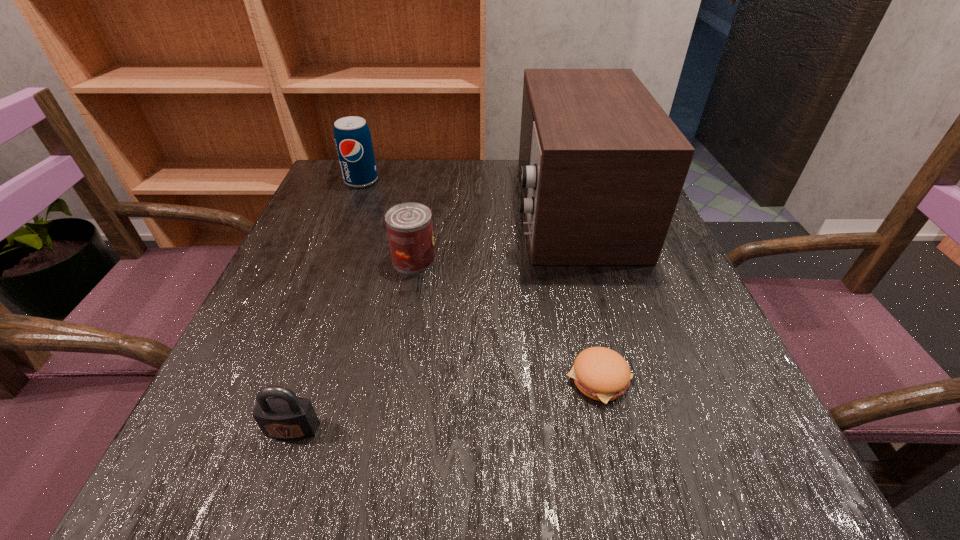
This screenshot has width=960, height=540. I want to click on vacant area situated on the back of the can, so click(x=420, y=218).

This screenshot has height=540, width=960. Identify the location of vacant region located 0.110m on the front of the patty. (625, 488).

You are a GUI agent. You are given a task and a screenshot of the screen. Output one action in this format:
    pyautogui.click(x=<x>, y=<y>)
    Task: Click on the radio receiver at the far edge
    The height and width of the screenshot is (540, 960).
    Given the screenshot: What is the action you would take?
    pyautogui.click(x=602, y=166)

Find the location of a particular element. This screenshot has height=540, width=960. pop situated at the far edge is located at coordinates (352, 136).

Where is `object present at the near edge`? The height and width of the screenshot is (540, 960). object present at the near edge is located at coordinates (284, 416).

Find the location of a particular element. Image resolution: width=960 pixels, height=540 pixels. pop that is at the left edge is located at coordinates (352, 136).

In order to click on padlock at the left edge in this screenshot , I will do `click(284, 416)`.

This screenshot has width=960, height=540. Find the location of `radio receiver that is at the right edge`. radio receiver that is at the right edge is located at coordinates (602, 166).

Locate an element on the screen. Image resolution: width=960 pixels, height=540 pixels. patty that is at the right edge is located at coordinates (600, 373).

This screenshot has width=960, height=540. I want to click on object located at the far left corner, so click(x=352, y=136).